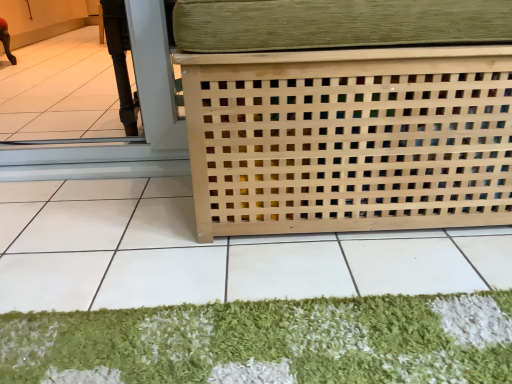
Question: Considering the relative sizes of natural wood lattice at center and green shaggy mat at lower center in the image provided, is natural wood lattice at center bigger than green shaggy mat at lower center?

Choices:
 (A) no
 (B) yes

Answer: (B)

Question: Considering the relative positions of natural wood lattice at center and green shaggy mat at lower center in the image provided, is natural wood lattice at center to the right of green shaggy mat at lower center from the viewer's perspective?

Choices:
 (A) yes
 (B) no

Answer: (B)

Question: Considering the relative positions of natural wood lattice at center and green shaggy mat at lower center in the image provided, is natural wood lattice at center in front of green shaggy mat at lower center?

Choices:
 (A) yes
 (B) no

Answer: (A)

Question: From the image's perspective, is natural wood lattice at center located above green shaggy mat at lower center?

Choices:
 (A) no
 (B) yes

Answer: (B)

Question: Is green shaggy mat at lower center surrounded by natural wood lattice at center?

Choices:
 (A) no
 (B) yes

Answer: (B)

Question: Is natural wood lattice at center placed right next to green shaggy mat at lower center?

Choices:
 (A) no
 (B) yes

Answer: (A)

Question: From the image's perspective, does green shaggy mat at lower center appear higher than natural wood lattice at center?

Choices:
 (A) yes
 (B) no

Answer: (B)

Question: Does green shaggy mat at lower center have a lesser height compared to natural wood lattice at center?

Choices:
 (A) yes
 (B) no

Answer: (A)

Question: Is green shaggy mat at lower center positioned with its back to natural wood lattice at center?

Choices:
 (A) yes
 (B) no

Answer: (B)

Question: Is green shaggy mat at lower center further to the viewer compared to natural wood lattice at center?

Choices:
 (A) no
 (B) yes

Answer: (A)

Question: From the image's perspective, is green shaggy mat at lower center below natural wood lattice at center?

Choices:
 (A) no
 (B) yes

Answer: (B)

Question: Is green shaggy mat at lower center with natural wood lattice at center?

Choices:
 (A) no
 (B) yes

Answer: (A)

Question: From a real-world perspective, does natural wood lattice at center stand above natural wood lattice at center?

Choices:
 (A) yes
 (B) no

Answer: (A)